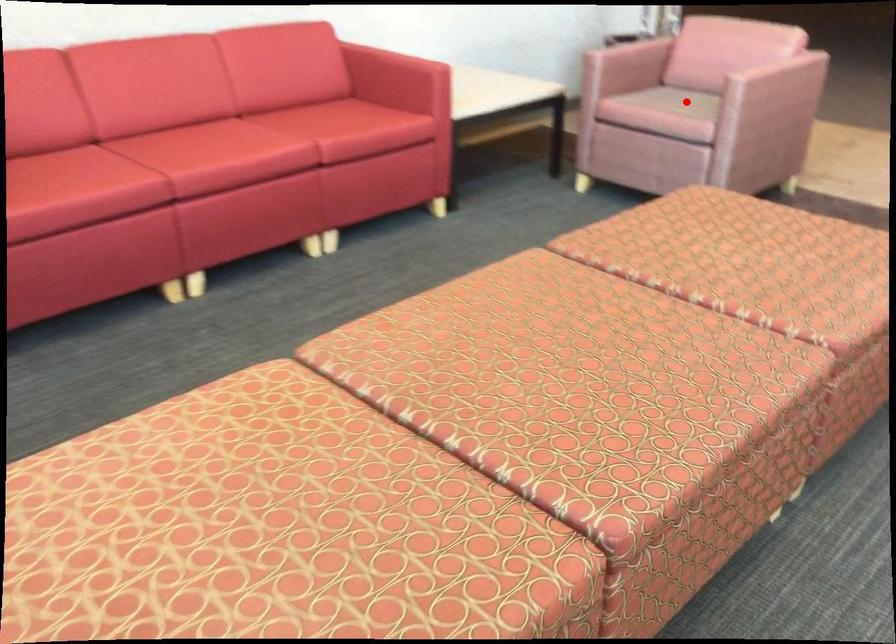
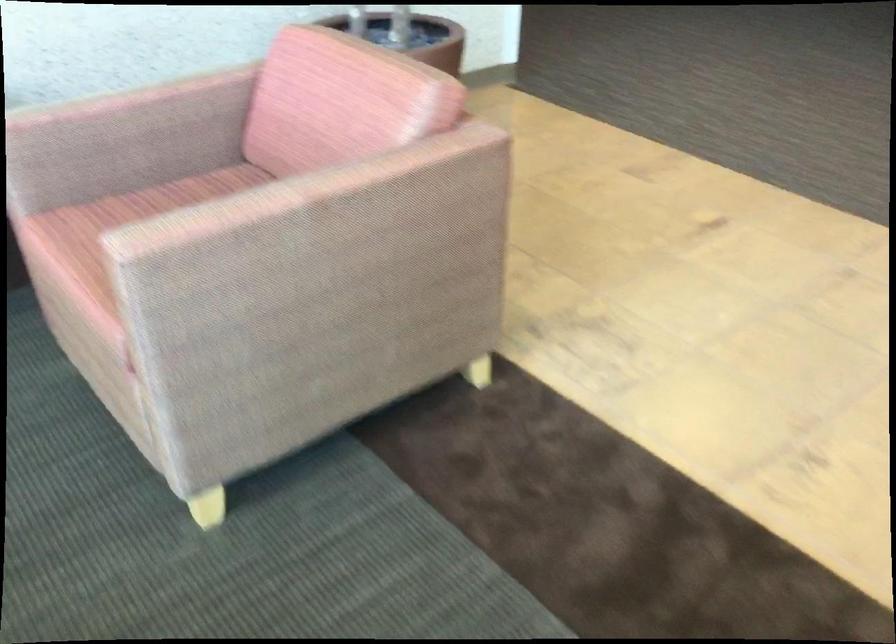
Question: I am providing you with two images of the same scene from different viewpoints. A red point is marked on the first image. At the location where the point appears in image 1, is it still visible in image 2?

Choices:
 (A) Yes
 (B) No

Answer: (B)